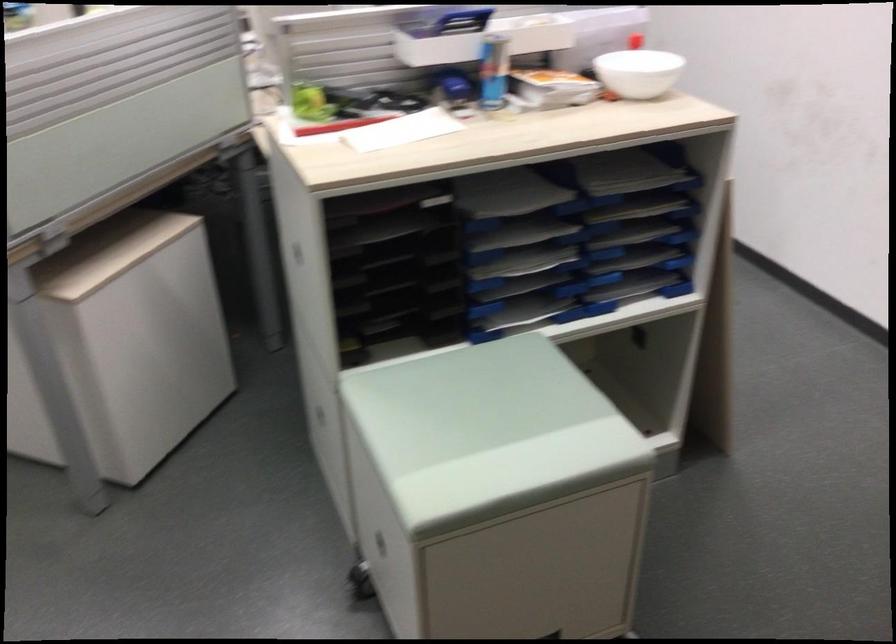
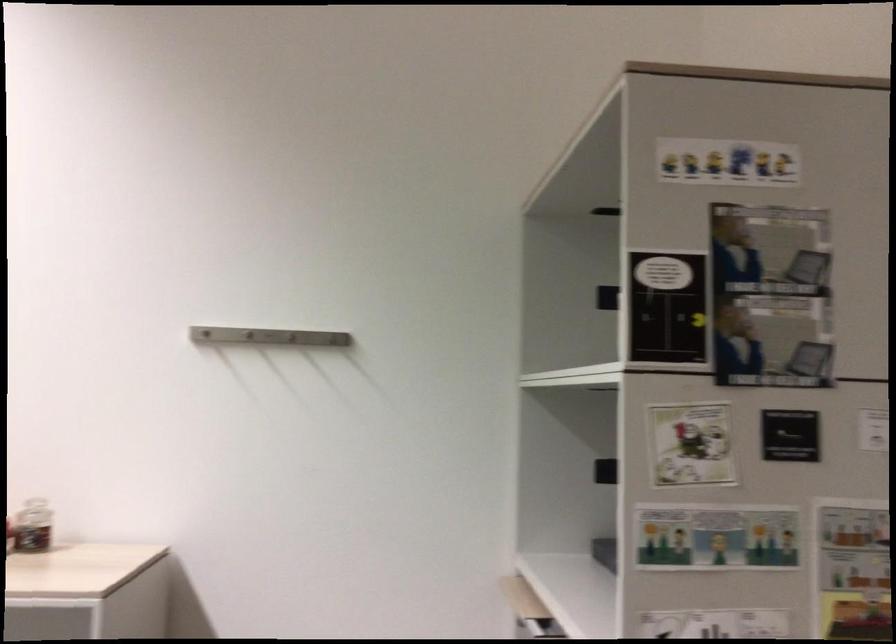
Question: The camera is either moving clockwise (left) or counter-clockwise (right) around the object. The first image is from the beginning of the video and the second image is from the end. Is the camera moving left or right when shooting the video?

Choices:
 (A) Left
 (B) Right

Answer: (A)